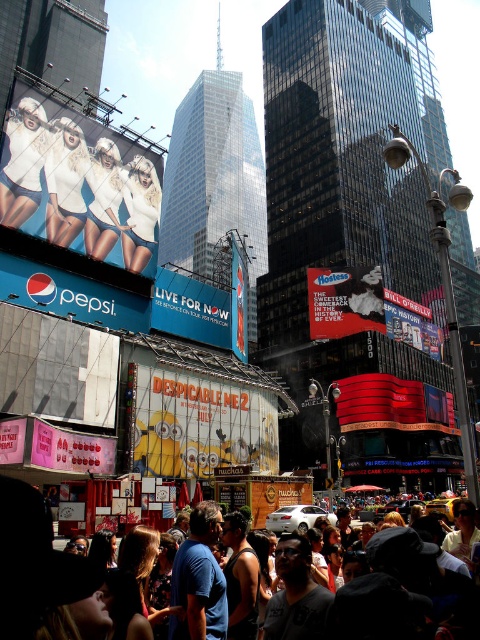
Can you confirm if yellow cartoon characters at center is positioned to the left of pink matte sign at center?

In fact, yellow cartoon characters at center is to the right of pink matte sign at center.

What do you see at coordinates (200, 426) in the screenshot? This screenshot has height=640, width=480. I see `yellow cartoon characters at center` at bounding box center [200, 426].

Identify the location of yellow cartoon characters at center. (200, 426).

Can you confirm if yellow cartoon characters at center is positioned above white matte shorts at upper left?

Incorrect, yellow cartoon characters at center is not positioned above white matte shorts at upper left.

Between point (164, 467) and point (79, 128), which one is positioned in front?

Point (164, 467) is in front.

What are the coordinates of `yellow cartoon characters at center` in the screenshot? It's located at (200, 426).

Between white glossy billboard at upper left and dark gray clothing at lower center, which one is positioned lower?

Positioned lower is dark gray clothing at lower center.

The image size is (480, 640). Identify the location of white glossy billboard at upper left. [x=79, y=182].